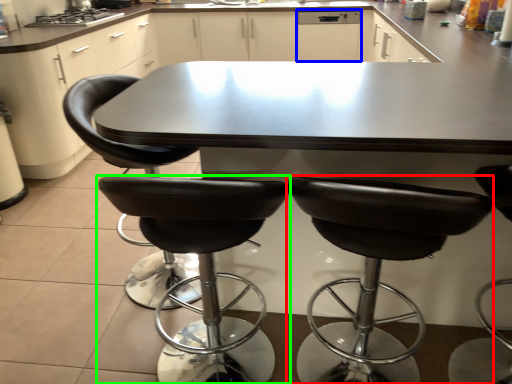
Question: Which object is positioned farthest from chair (highlighted by a red box)? Select from dish washer (highlighted by a blue box) and chair (highlighted by a green box).

Choices:
 (A) dish washer
 (B) chair

Answer: (A)